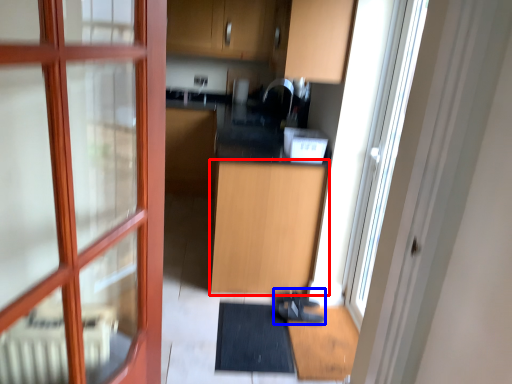
Question: Which of the following is the closest to the observer, cabinetry (highlighted by a red box) or shoe (highlighted by a blue box)?

Choices:
 (A) cabinetry
 (B) shoe

Answer: (A)